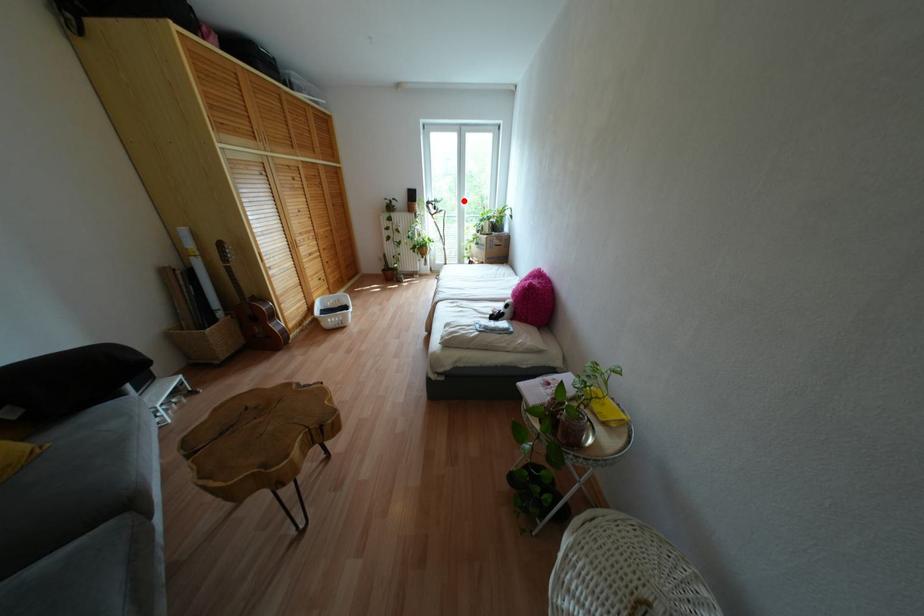
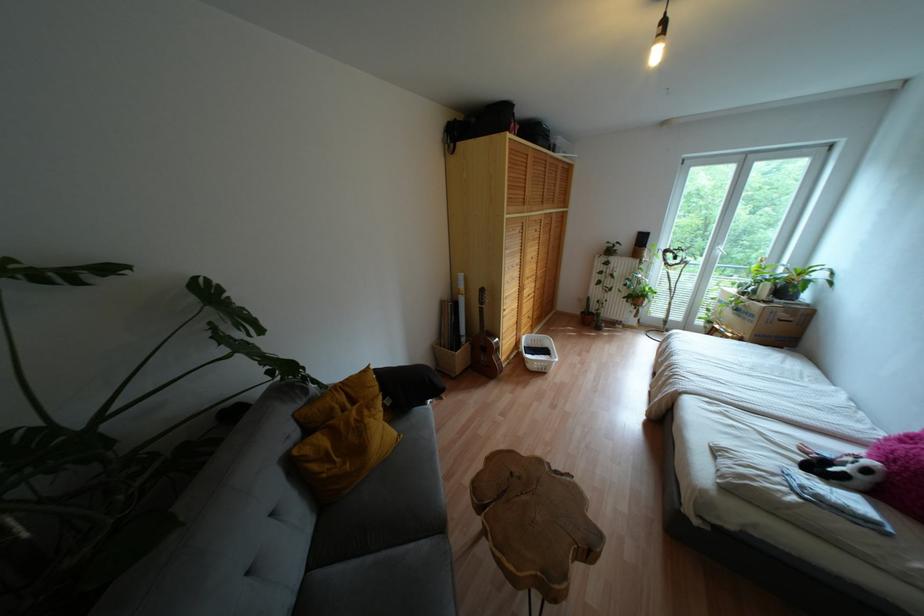
The point at the highlighted location is marked in the first image. Where is the corresponding point in the second image?

(723, 248)